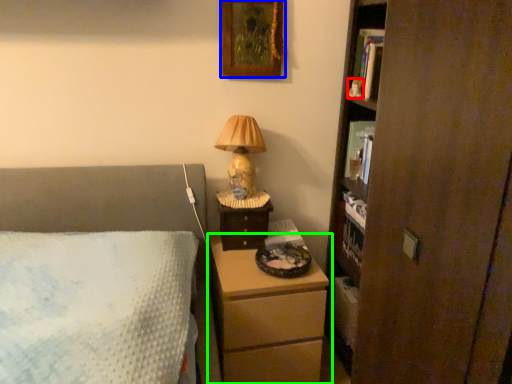
Question: Which is nearer to the toy (highlighted by a red box)? picture frame (highlighted by a blue box) or chest of drawers (highlighted by a green box).

Choices:
 (A) picture frame
 (B) chest of drawers

Answer: (A)